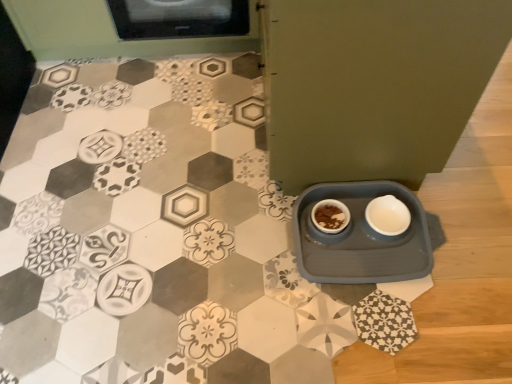
Locate an element on the screen. The image size is (512, 384). unoccupied area in front of gray plastic tray at lower right is located at coordinates (386, 333).